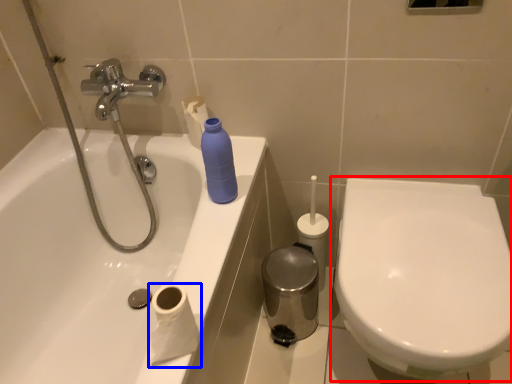
Question: Which object is closer to the camera taking this photo, toilet (highlighted by a red box) or toilet paper (highlighted by a blue box)?

Choices:
 (A) toilet
 (B) toilet paper

Answer: (B)